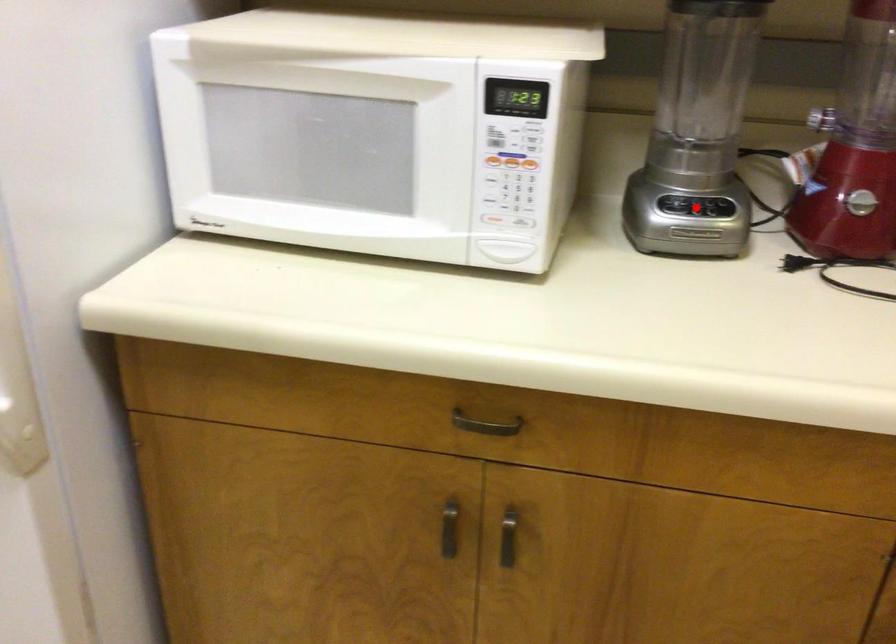
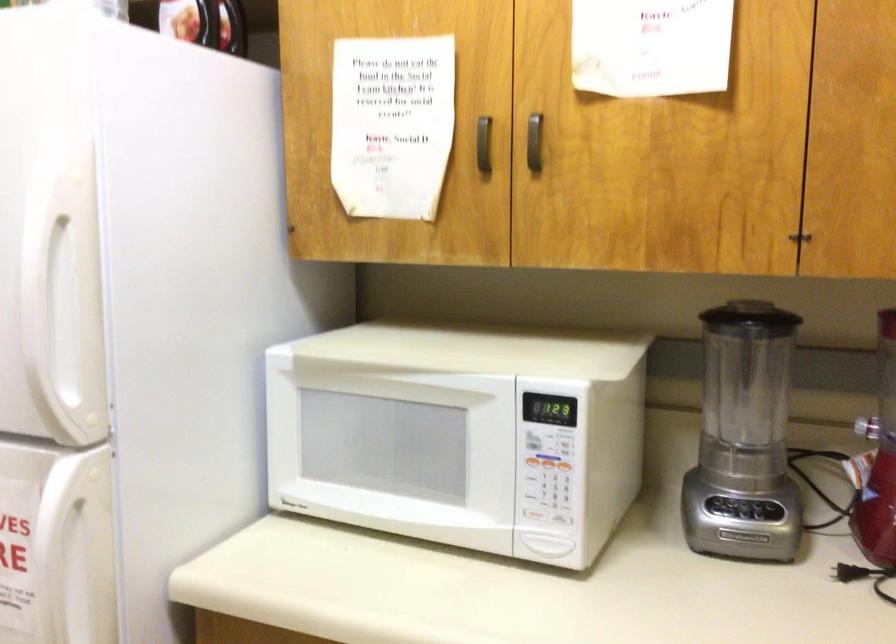
The point at the highlighted location is marked in the first image. Where is the corresponding point in the second image?

(744, 512)